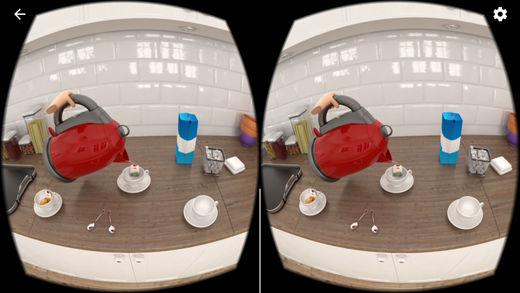
Locate an element on the screen. Image resolution: width=520 pixels, height=293 pixels. cabinets is located at coordinates (364, 266), (431, 268), (168, 267), (109, 266).